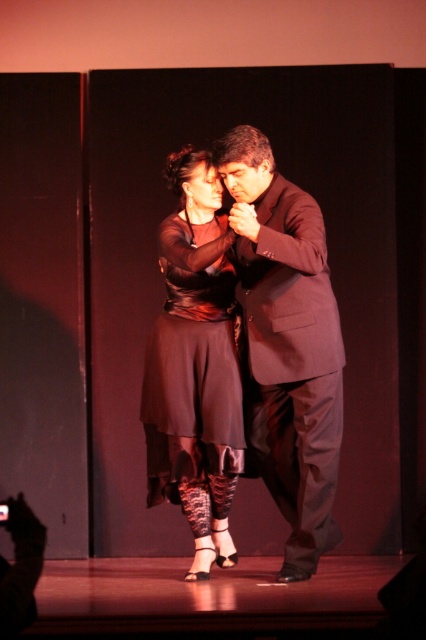
Consider the image. Is dark brown suit at center bigger than black satin dress at center?

Indeed, dark brown suit at center has a larger size compared to black satin dress at center.

The image size is (426, 640). I want to click on dark brown suit at center, so click(287, 342).